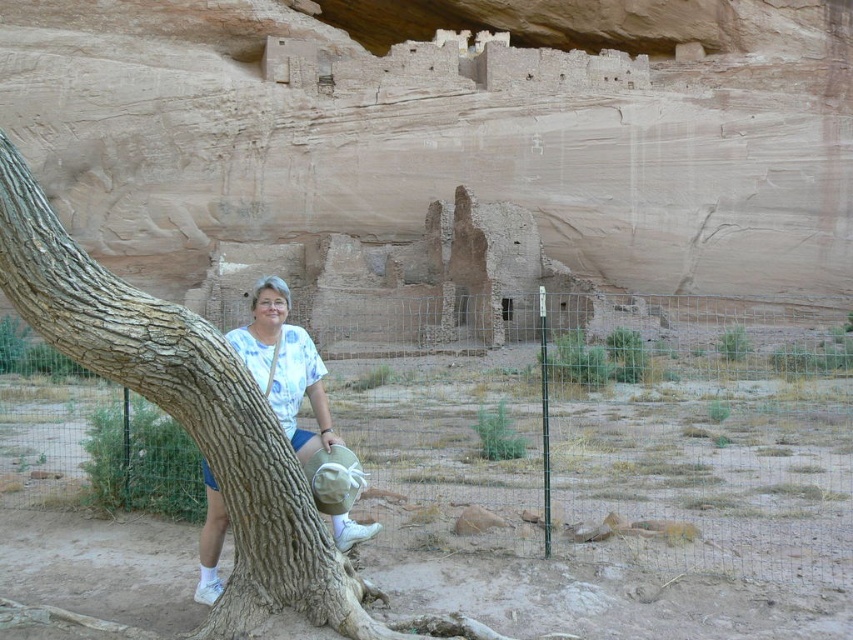
You are standing in the desert scene and want to take a photo of the brown rough bark tree at center. Your camera has a maximum focus range of 25 meters. Will you be able to focus on the tree?

The brown rough bark tree at center is 25.92 meters away from the viewer. Since your camera can only focus up to 25 meters, you will not be able to focus on the tree.

You are standing in the desert scene and want to take a photo of the brown rough bark tree at center. If you are facing north, which direction should you turn to locate the tree?

The brown rough bark tree at center is located at coordinates point (194, 422), which is to the east of your current position. Therefore, you should turn east to face the tree.

You are standing at the point with coordinates point [263,634] and want to walk towards the point with coordinates point [306,381]. Which direction should you face to walk directly towards it?

To walk directly towards point [306,381] from point [263,634], you should face west because point [263,634] is to the east of point [306,381].